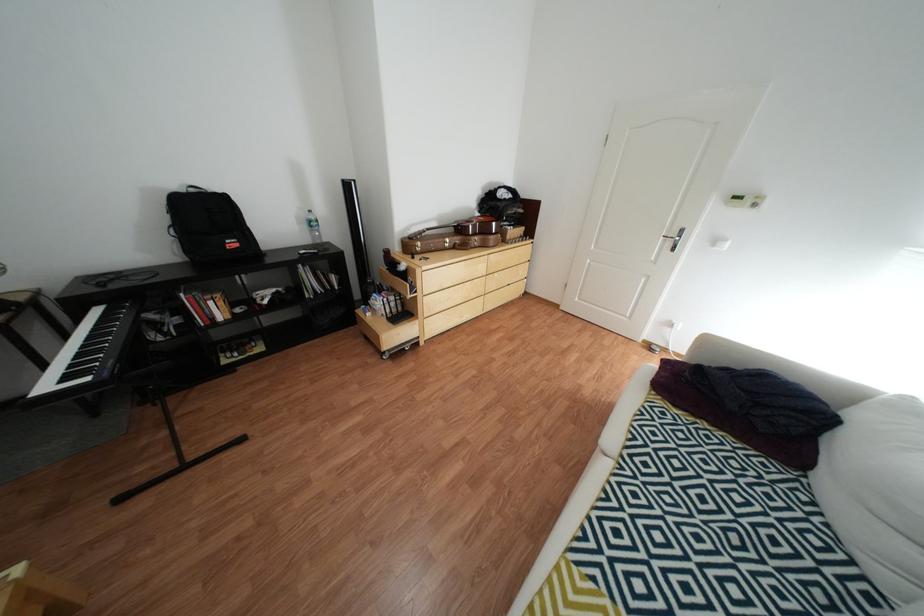
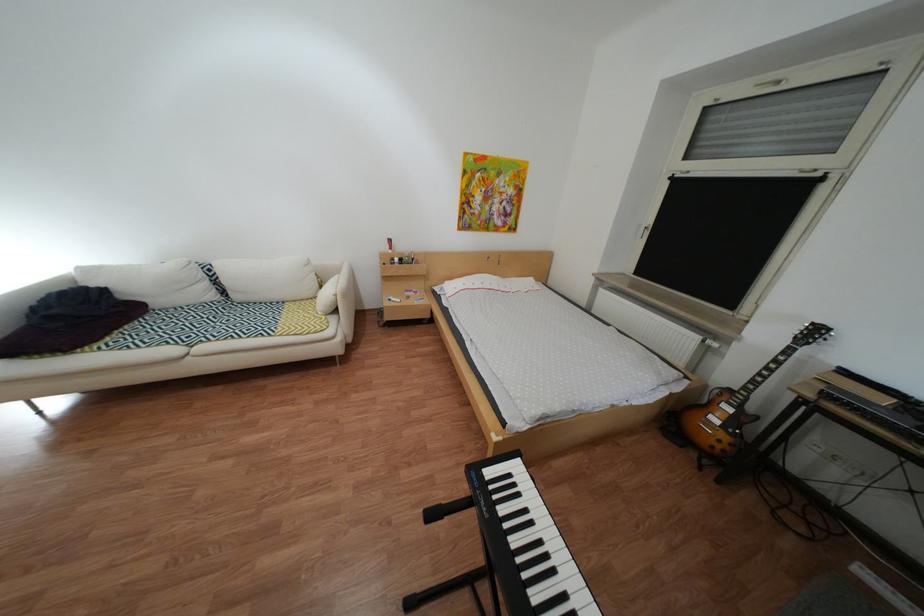
Locate, in the second image, the point that corresponds to point (676, 403) in the first image.

(113, 346)